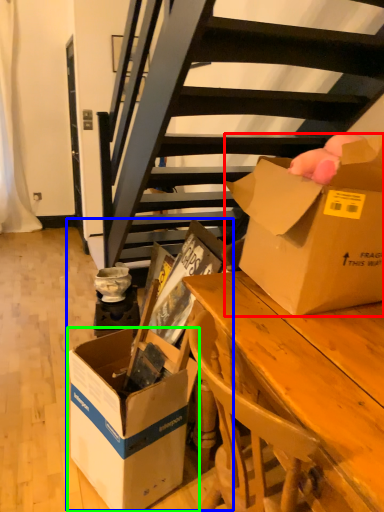
Question: Which object is the closest to the box (highlighted by a red box)? Choose among these: storage box (highlighted by a blue box) or box (highlighted by a green box).

Choices:
 (A) storage box
 (B) box

Answer: (A)